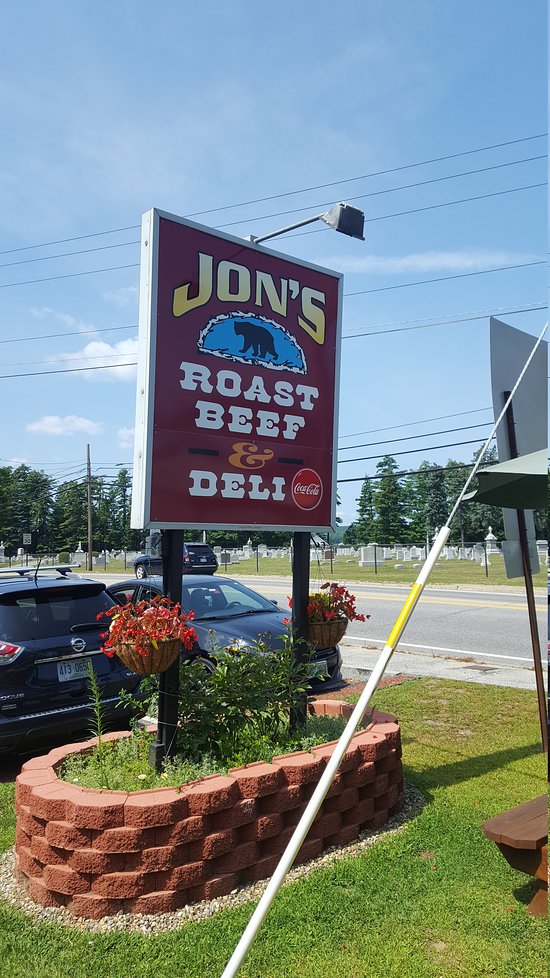
Where is `flower baskets`? flower baskets is located at coordinates (324, 629), (162, 652).